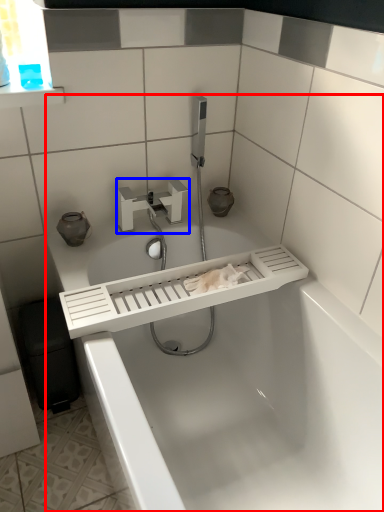
Question: Which object is closer to the camera taking this photo, bathtub (highlighted by a red box) or tap (highlighted by a blue box)?

Choices:
 (A) bathtub
 (B) tap

Answer: (A)